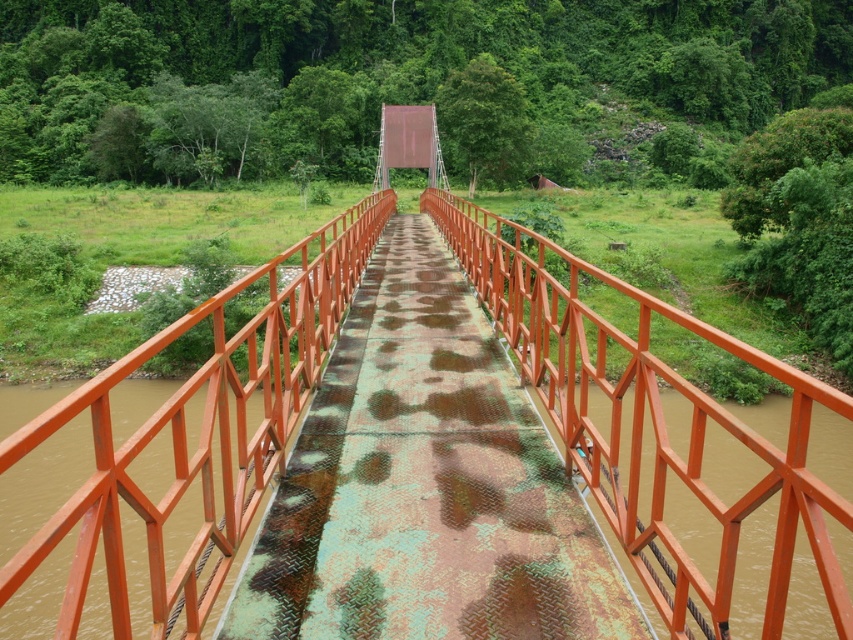
Question: Can you confirm if rusty metal bridge at center is positioned to the right of orange metal/rustic rail at center?

Choices:
 (A) no
 (B) yes

Answer: (B)

Question: Does rusty metal bridge at center have a greater width compared to orange metal/rustic rail at center?

Choices:
 (A) yes
 (B) no

Answer: (B)

Question: Does rusty metal bridge at center come in front of orange metal/rustic rail at center?

Choices:
 (A) no
 (B) yes

Answer: (A)

Question: Which object appears closest to the camera in this image?

Choices:
 (A) rusty metal bridge at center
 (B) orange metal/rustic rail at center

Answer: (B)

Question: Which point is farther to the camera?

Choices:
 (A) rusty metal bridge at center
 (B) orange metal/rustic rail at center

Answer: (A)

Question: Which point is farther to the camera?

Choices:
 (A) (233, 524)
 (B) (450, 433)

Answer: (B)